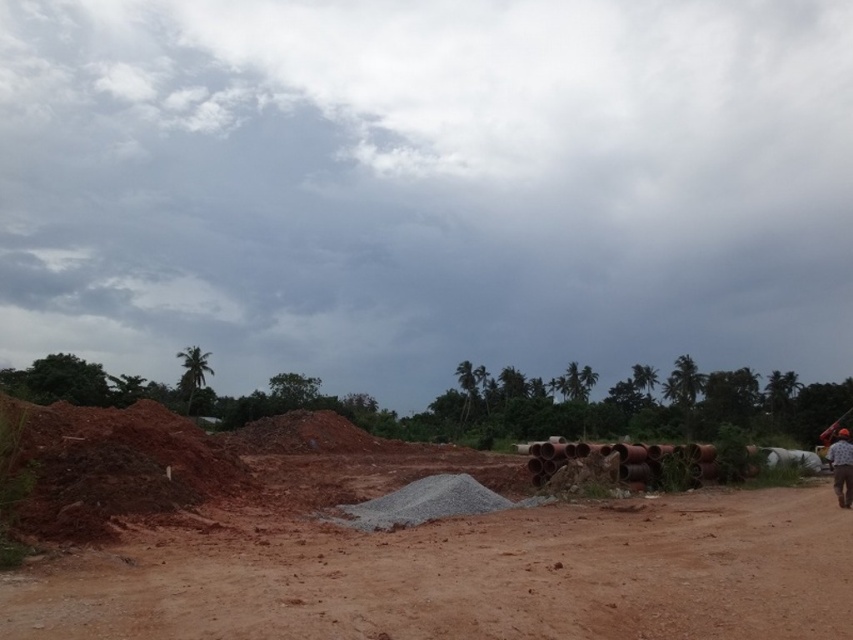
You are a construction worker standing on the brown dirt field at center and looking towards the brown fabric shirt at lower right. Which object is closer to the ground?

The brown dirt field at center is shorter than the brown fabric shirt at lower right, so the brown dirt field at center is closer to the ground.

You are a construction worker standing at the center of the dirt road. You see two points marked in the image. Which point is closer to you? The points are point [86,588] and point [840,449].

Point [86,588] is in front of point [840,449], so it is closer to you.